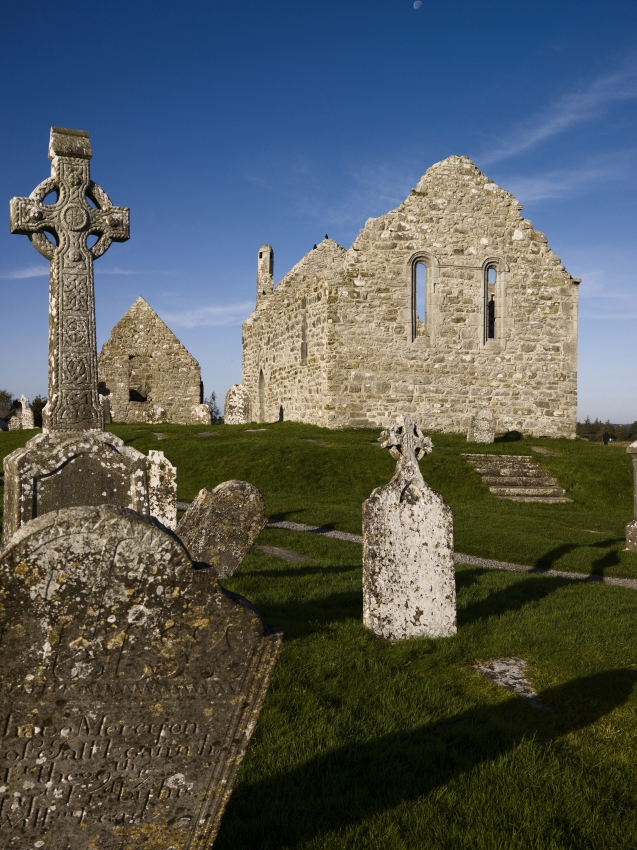
Locate an element on the screen. steps / stairs is located at coordinates (520, 483).